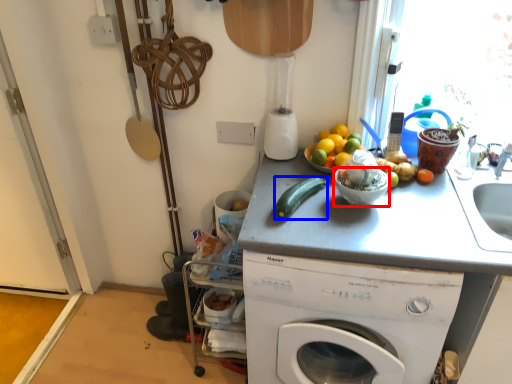
Question: Among these objects, which one is farthest to the camera, basin (highlighted by a red box) or green vegetables (highlighted by a blue box)?

Choices:
 (A) basin
 (B) green vegetables

Answer: (A)